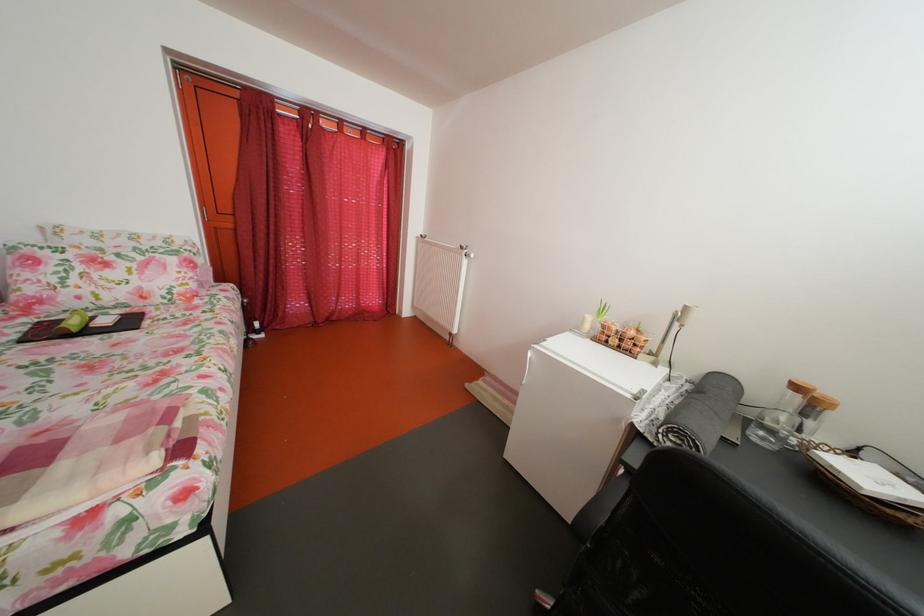
Find where to lift the wooden jar lid. Please return your answer as a coordinate pair (x, y).

(824, 402)